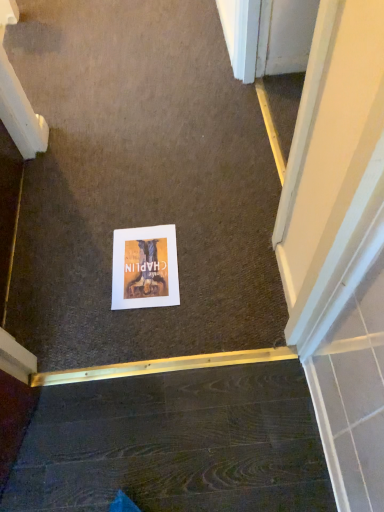
You are a GUI agent. You are given a task and a screenshot of the screen. Output one action in this format:
    pyautogui.click(x=<x>, y=<y>)
    Task: Click on the vacant area in front of white paper at center
    The height and width of the screenshot is (512, 384).
    Given the screenshot: What is the action you would take?
    pyautogui.click(x=147, y=335)